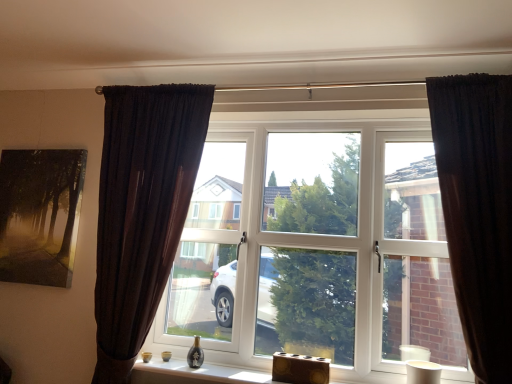
Question: Is wooden block at lower center outside of wooden block at lower center?

Choices:
 (A) yes
 (B) no

Answer: (A)

Question: Is wooden block at lower center next to wooden block at lower center?

Choices:
 (A) yes
 (B) no

Answer: (B)

Question: Does wooden block at lower center contain wooden block at lower center?

Choices:
 (A) no
 (B) yes

Answer: (A)

Question: Is wooden block at lower center taller than wooden block at lower center?

Choices:
 (A) no
 (B) yes

Answer: (B)

Question: Considering the relative sizes of wooden block at lower center and wooden block at lower center in the image provided, is wooden block at lower center wider than wooden block at lower center?

Choices:
 (A) yes
 (B) no

Answer: (B)

Question: From the image's perspective, would you say wooden block at lower center is positioned over wooden block at lower center?

Choices:
 (A) no
 (B) yes

Answer: (B)

Question: Does wooden block at lower center come in front of dark velvet curtain at right, the 1th curtain positioned from the right?

Choices:
 (A) no
 (B) yes

Answer: (A)

Question: Is wooden block at lower center smaller than dark velvet curtain at right, which appears as the second curtain when viewed from the left?

Choices:
 (A) yes
 (B) no

Answer: (A)

Question: From the image's perspective, is wooden block at lower center under dark velvet curtain at right, the 1th curtain positioned from the right?

Choices:
 (A) no
 (B) yes

Answer: (B)

Question: Is wooden block at lower center taller than dark velvet curtain at right, the 1th curtain positioned from the right?

Choices:
 (A) yes
 (B) no

Answer: (B)

Question: Is wooden block at lower center thinner than dark velvet curtain at right, which appears as the second curtain when viewed from the left?

Choices:
 (A) yes
 (B) no

Answer: (B)

Question: Does wooden block at lower center appear on the left side of dark velvet curtain at right, the 1th curtain positioned from the right?

Choices:
 (A) yes
 (B) no

Answer: (A)

Question: Considering the relative sizes of dark brown fabric curtain at left, the first curtain when ordered from left to right, and matte black painting at upper left in the image provided, is dark brown fabric curtain at left, the first curtain when ordered from left to right, shorter than matte black painting at upper left?

Choices:
 (A) no
 (B) yes

Answer: (A)